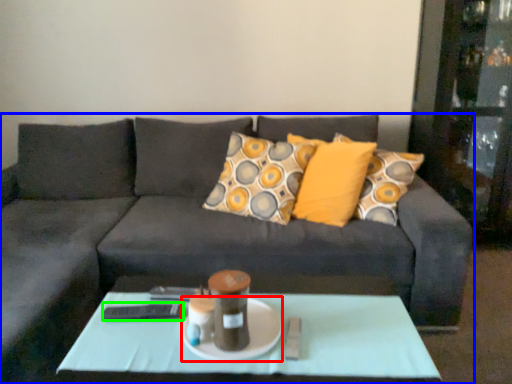
Question: Based on their relative distances, which object is farther from glass plate (highlighted by a red box)? Choose from studio couch (highlighted by a blue box) and remote (highlighted by a green box).

Choices:
 (A) studio couch
 (B) remote

Answer: (A)